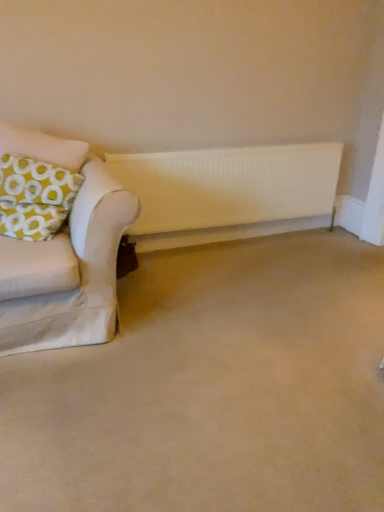
Question: Can you confirm if white matte radiator at center is thinner than yellow-green fabric pillow at left?

Choices:
 (A) yes
 (B) no

Answer: (A)

Question: Can you confirm if white matte radiator at center is bigger than yellow-green fabric pillow at left?

Choices:
 (A) yes
 (B) no

Answer: (B)

Question: From a real-world perspective, is white matte radiator at center on yellow-green fabric pillow at left?

Choices:
 (A) no
 (B) yes

Answer: (A)

Question: From the image's perspective, is white matte radiator at center below yellow-green fabric pillow at left?

Choices:
 (A) yes
 (B) no

Answer: (A)

Question: From the image's perspective, is white matte radiator at center above yellow-green fabric pillow at left?

Choices:
 (A) no
 (B) yes

Answer: (A)

Question: Does white matte radiator at center have a greater width compared to yellow-green fabric pillow at left?

Choices:
 (A) no
 (B) yes

Answer: (A)

Question: Considering the relative positions of yellow-green fabric pillow at left and white matte radiator at center in the image provided, is yellow-green fabric pillow at left behind white matte radiator at center?

Choices:
 (A) yes
 (B) no

Answer: (B)

Question: Is yellow-green fabric pillow at left wider than white matte radiator at center?

Choices:
 (A) yes
 (B) no

Answer: (A)

Question: Does yellow-green fabric pillow at left have a smaller size compared to white matte radiator at center?

Choices:
 (A) yes
 (B) no

Answer: (B)

Question: Is yellow-green fabric pillow at left to the right of white matte radiator at center from the viewer's perspective?

Choices:
 (A) yes
 (B) no

Answer: (B)

Question: Is yellow-green fabric pillow at left not inside white matte radiator at center?

Choices:
 (A) yes
 (B) no

Answer: (A)

Question: Does yellow-green fabric pillow at left have a greater height compared to white matte radiator at center?

Choices:
 (A) no
 (B) yes

Answer: (A)

Question: Is beige carpet at lower center not close to white matte radiator at center?

Choices:
 (A) no
 (B) yes

Answer: (A)